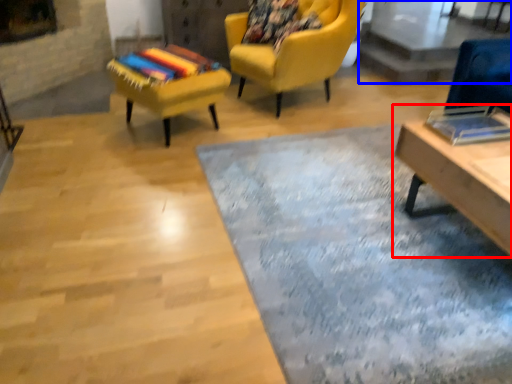
Question: Which object appears farthest to the camera in this image, table (highlighted by a red box) or glass table (highlighted by a blue box)?

Choices:
 (A) table
 (B) glass table

Answer: (B)